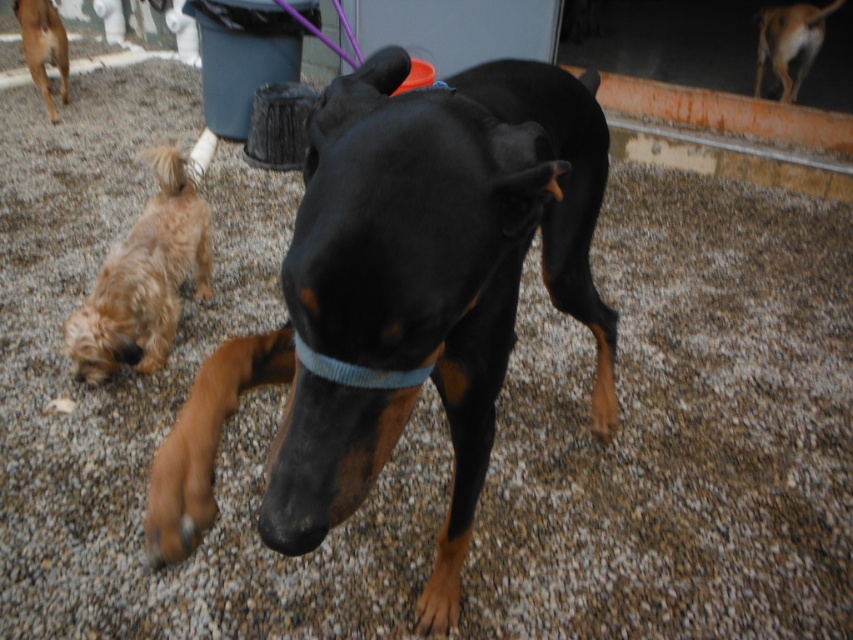
Question: Can you confirm if black smooth dog at center is thinner than brown fur dog at upper left?

Choices:
 (A) no
 (B) yes

Answer: (A)

Question: Which point appears farthest from the camera in this image?

Choices:
 (A) (506, 296)
 (B) (207, 250)
 (C) (787, 100)
 (D) (403, 378)

Answer: (C)

Question: Is fuzzy brown dog at lower left thinner than brown fur dog at upper right?

Choices:
 (A) yes
 (B) no

Answer: (A)

Question: Is brown fur dog at upper left smaller than blue knitted collar at center?

Choices:
 (A) no
 (B) yes

Answer: (A)

Question: Considering the real-world distances, which object is farthest from the brown fur dog at upper right?

Choices:
 (A) fuzzy brown dog at lower left
 (B) blue knitted collar at center
 (C) black smooth dog at center
 (D) brown fur dog at upper left

Answer: (D)

Question: Which of these objects is positioned closest to the brown fur dog at upper right?

Choices:
 (A) black smooth dog at center
 (B) brown fur dog at upper left
 (C) fuzzy brown dog at lower left

Answer: (A)